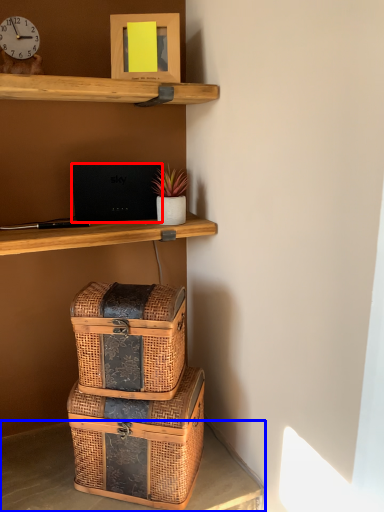
Question: Which object appears farthest to the camera in this image, laptop (highlighted by a red box) or desk (highlighted by a blue box)?

Choices:
 (A) laptop
 (B) desk

Answer: (A)